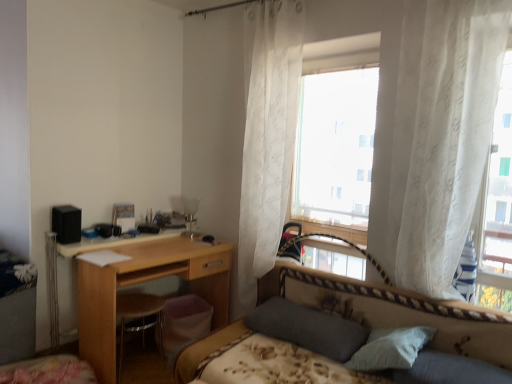
Identify the location of blank space situated above brown leather swivel chair at lower left (from a real-world perspective). (143, 303).